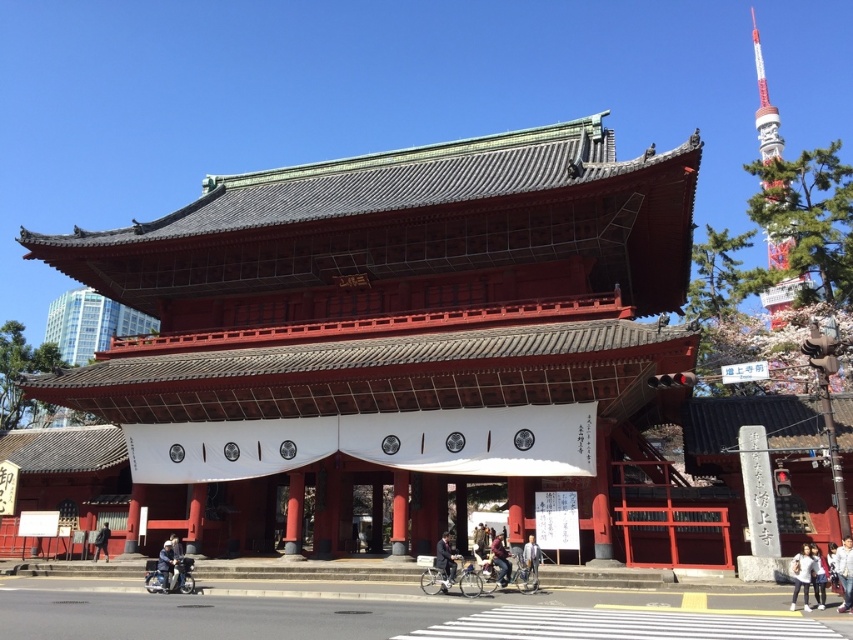
You are standing at the entrance of the Shinto shrine and want to take a photo of the metallic red tower at upper right and the denim jacket at center. Which object should you focus on first to ensure both are in frame?

You should focus on the denim jacket at center first because the metallic red tower at upper right is located above it, so adjusting the camera angle to include the lower denim jacket will naturally include the higher tower in the frame.

You are visiting a Shinto shrine and notice a white cotton shirt at center and a black fabric bag at lower left. Which item appears bigger in the scene?

The white cotton shirt at center is larger in size than the black fabric bag at lower left, so the white cotton shirt at center appears bigger.